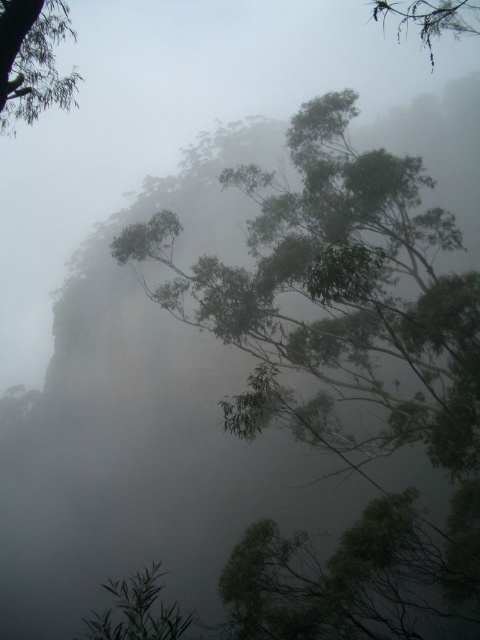
Is green leafy tree at lower left to the left of green leafy tree at upper right from the viewer's perspective?

Yes, green leafy tree at lower left is to the left of green leafy tree at upper right.

Which is more to the left, green leafy tree at lower left or green leafy tree at upper right?

green leafy tree at lower left

Find the location of a particular element. The image size is (480, 640). green leafy tree at lower left is located at coordinates (x=136, y=611).

Locate an element on the screen. Image resolution: width=480 pixels, height=640 pixels. green leafy tree at lower left is located at coordinates point(136,611).

Who is more distant from viewer, (25, 13) or (172, 614)?

The point (172, 614) is behind.

Describe the element at coordinates (33, 60) in the screenshot. I see `green leafy tree at upper left` at that location.

Find the location of a particular element. The height and width of the screenshot is (640, 480). green leafy tree at upper left is located at coordinates 33,60.

Is point (2, 3) more distant than point (406, 26)?

No, (2, 3) is in front of (406, 26).

Can you confirm if green leafy tree at upper left is positioned to the left of green leafy tree at upper right?

Indeed, green leafy tree at upper left is positioned on the left side of green leafy tree at upper right.

Which is behind, point (46, 1) or point (419, 20)?

Point (419, 20)

The width and height of the screenshot is (480, 640). Identify the location of green leafy tree at upper left. (33, 60).